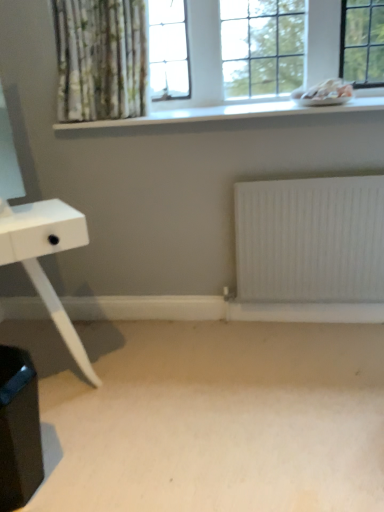
At what (x,y) coordinates should I click in order to perform the action: click on free space underneath white matte table at left (from a real-world perspective). Please return your answer as a coordinate pair (x, y). This screenshot has height=512, width=384. Looking at the image, I should click on (71, 398).